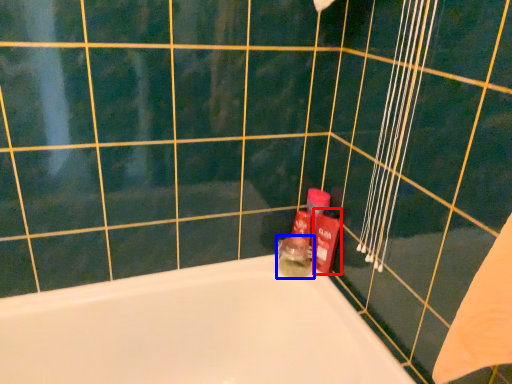
Question: Which of the following is the farthest to the observer, toiletry (highlighted by a red box) or toiletry (highlighted by a blue box)?

Choices:
 (A) toiletry
 (B) toiletry

Answer: (B)